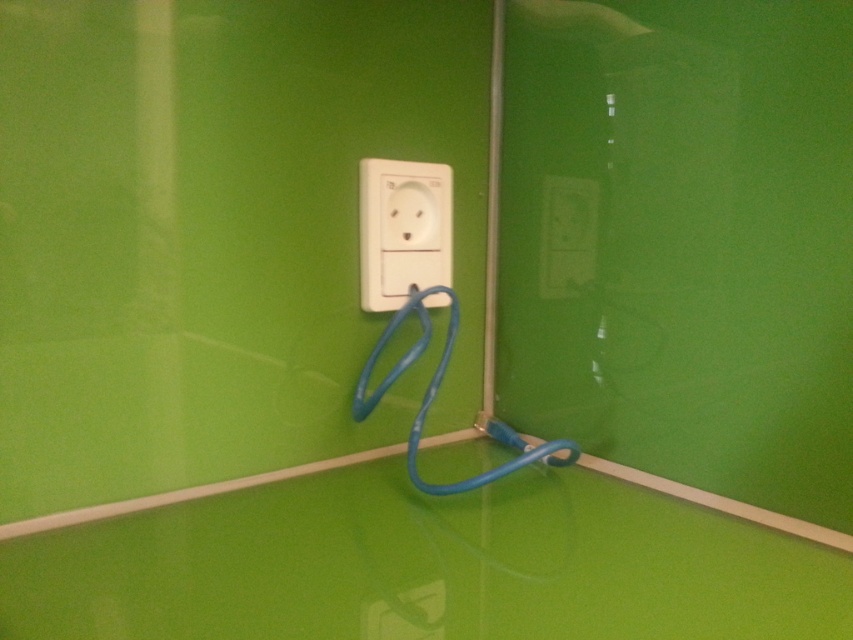
You are trying to plug in a new cable into the white plastic socket at center but notice the white plastic outlet at lower center is blocking the way. Can you plug the cable in without moving the outlet?

The white plastic outlet at lower center is behind the white plastic socket at center, so you can plug the cable into the white plastic socket at center without moving the outlet because it is not in front of it.

You are holding a 30 inch long tool and want to reach the white plastic outlet at upper center. Can you reach it?

The white plastic outlet at upper center is 32.63 inches from the camera, so the 30 inch tool may not be long enough to reach it.

You are trying to plug in a new device into an outlet in this room. You have two options, the white plastic outlet at upper center and the white plastic outlet at lower center. Which one is positioned higher up on the wall?

The white plastic outlet at upper center is positioned higher up on the wall than the white plastic outlet at lower center.